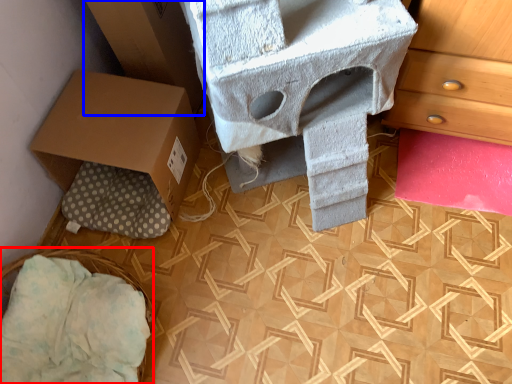
Question: Among these objects, which one is farthest to the camera, basket (highlighted by a red box) or cardboard box (highlighted by a blue box)?

Choices:
 (A) basket
 (B) cardboard box

Answer: (B)